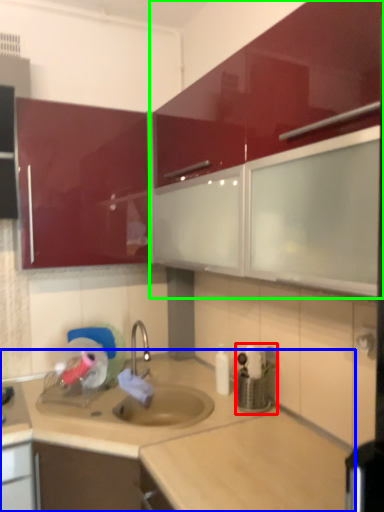
Question: Considering the real-world distances, which object is farthest from appliance (highlighted by a red box)? countertop (highlighted by a blue box) or cabinetry (highlighted by a green box)?

Choices:
 (A) countertop
 (B) cabinetry

Answer: (B)